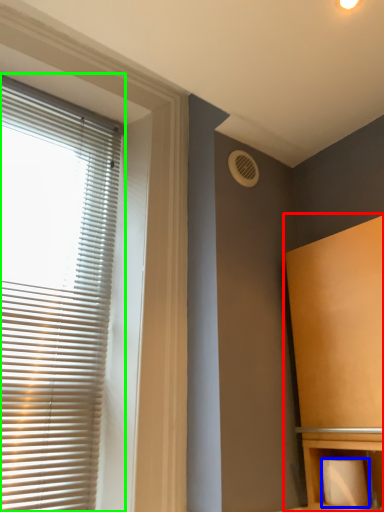
Question: Which is farther away from furniture (highlighted by a red box)? toilet paper (highlighted by a blue box) or window blind (highlighted by a green box)?

Choices:
 (A) toilet paper
 (B) window blind

Answer: (B)